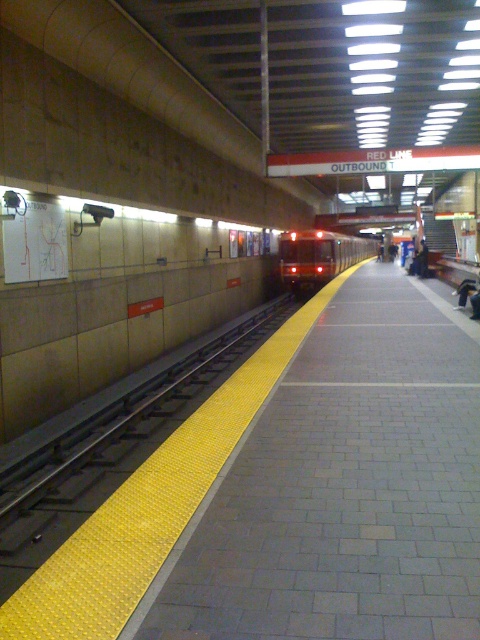
Question: Can you confirm if yellow textured platform at center is bigger than red glossy train at center?

Choices:
 (A) no
 (B) yes

Answer: (A)

Question: Which object is closer to the camera taking this photo?

Choices:
 (A) red glossy train at center
 (B) yellow textured platform at center

Answer: (B)

Question: Among these points, which one is farthest from the camera?

Choices:
 (A) (326, 600)
 (B) (337, 264)

Answer: (B)

Question: Can you confirm if yellow textured platform at center is wider than red glossy train at center?

Choices:
 (A) no
 (B) yes

Answer: (A)

Question: Which point appears closest to the camera in this image?

Choices:
 (A) click(416, 458)
 (B) click(324, 268)

Answer: (A)

Question: Does yellow textured platform at center appear under red glossy train at center?

Choices:
 (A) no
 (B) yes

Answer: (B)